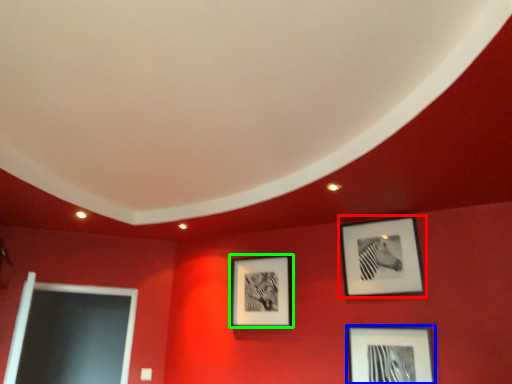
Question: Which is farther away from picture frame (highlighted by a red box)? picture frame (highlighted by a blue box) or picture frame (highlighted by a green box)?

Choices:
 (A) picture frame
 (B) picture frame

Answer: (B)